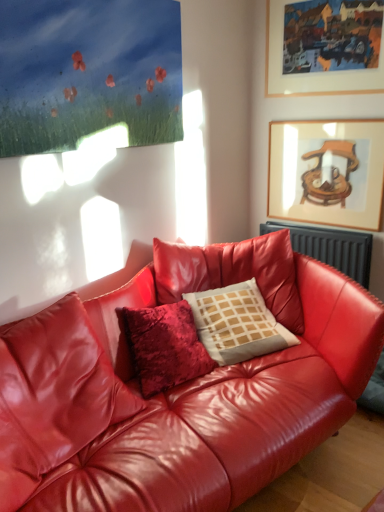
Where is `shiny red leather couch at center`? This screenshot has width=384, height=512. shiny red leather couch at center is located at coordinates (196, 392).

Identify the location of wooden-framed painting at upper right, placed as the second picture frame when sorted from bottom to top. (312, 73).

Do you think white textured pillow at center is within shiny red leather couch at center, or outside of it?

white textured pillow at center lies within the bounds of shiny red leather couch at center.

From the image's perspective, is white textured pillow at center on shiny red leather couch at center?

Yes.

Does white textured pillow at center come in front of shiny red leather couch at center?

No, it is not.

Which object is positioned more to the right, white textured pillow at center or shiny red leather couch at center?

white textured pillow at center is more to the right.

How distant is matte wooden picture frame at upper right, which is counted as the first picture frame, starting from the bottom, from shiny red leather couch at center?

matte wooden picture frame at upper right, which is counted as the first picture frame, starting from the bottom, is 3.50 feet from shiny red leather couch at center.

Which object is thinner, matte wooden picture frame at upper right, which ranks as the second picture frame in top-to-bottom order, or shiny red leather couch at center?

matte wooden picture frame at upper right, which ranks as the second picture frame in top-to-bottom order.

Considering the relative sizes of matte wooden picture frame at upper right, which ranks as the second picture frame in top-to-bottom order, and shiny red leather couch at center in the image provided, is matte wooden picture frame at upper right, which ranks as the second picture frame in top-to-bottom order, shorter than shiny red leather couch at center?

Yes, matte wooden picture frame at upper right, which ranks as the second picture frame in top-to-bottom order, is shorter than shiny red leather couch at center.

How many degrees apart are the facing directions of matte wooden picture frame at upper right, which ranks as the second picture frame in top-to-bottom order, and shiny red leather couch at center?

matte wooden picture frame at upper right, which ranks as the second picture frame in top-to-bottom order, and shiny red leather couch at center are facing 77.8 degrees away from each other.

Considering their positions, is black metallic radiator at upper right located in front of or behind white textured pillow at center?

Visually, black metallic radiator at upper right is located behind white textured pillow at center.

Is point (288, 226) less distant than point (198, 334)?

No.

In order to click on pillow lying in front of the black metallic radiator at upper right in this screenshot , I will do `click(237, 323)`.

Is black metallic radiator at upper right facing away from white textured pillow at center?

That's not correct — black metallic radiator at upper right is not looking away from white textured pillow at center.

Can you confirm if wooden-framed painting at upper right, the 1th picture frame when ordered from top to bottom, is taller than black metallic radiator at upper right?

Correct, wooden-framed painting at upper right, the 1th picture frame when ordered from top to bottom, is much taller as black metallic radiator at upper right.

Does wooden-framed painting at upper right, placed as the second picture frame when sorted from bottom to top, have a lesser width compared to black metallic radiator at upper right?

Indeed, wooden-framed painting at upper right, placed as the second picture frame when sorted from bottom to top, has a lesser width compared to black metallic radiator at upper right.

Does wooden-framed painting at upper right, the 1th picture frame when ordered from top to bottom, turn towards black metallic radiator at upper right?

No, wooden-framed painting at upper right, the 1th picture frame when ordered from top to bottom, is not facing towards black metallic radiator at upper right.

Considering the sizes of objects wooden-framed painting at upper right, placed as the second picture frame when sorted from bottom to top, and shiny red leather couch at center in the image provided, who is taller, wooden-framed painting at upper right, placed as the second picture frame when sorted from bottom to top, or shiny red leather couch at center?

With more height is shiny red leather couch at center.

Between wooden-framed painting at upper right, the 1th picture frame when ordered from top to bottom, and shiny red leather couch at center, which one is positioned in front?

shiny red leather couch at center.

From the image's perspective, does wooden-framed painting at upper right, the 1th picture frame when ordered from top to bottom, appear lower than shiny red leather couch at center?

No.

Which is in front, point (277, 7) or point (39, 350)?

Positioned in front is point (39, 350).

Considering the relative sizes of matte wooden picture frame at upper right, which is counted as the first picture frame, starting from the bottom, and white textured pillow at center in the image provided, is matte wooden picture frame at upper right, which is counted as the first picture frame, starting from the bottom, shorter than white textured pillow at center?

Incorrect, the height of matte wooden picture frame at upper right, which is counted as the first picture frame, starting from the bottom, does not fall short of that of white textured pillow at center.

Is matte wooden picture frame at upper right, which ranks as the second picture frame in top-to-bottom order, beside white textured pillow at center?

No, matte wooden picture frame at upper right, which ranks as the second picture frame in top-to-bottom order, is not next to white textured pillow at center.

Which is in front, point (372, 209) or point (245, 298)?

The point (245, 298) is more forward.

From the image's perspective, who appears lower, matte wooden picture frame at upper right, which is counted as the first picture frame, starting from the bottom, or white textured pillow at center?

white textured pillow at center, from the image's perspective.

Between black metallic radiator at upper right and matte wooden picture frame at upper right, which ranks as the second picture frame in top-to-bottom order, which one appears on the right side from the viewer's perspective?

Positioned to the right is matte wooden picture frame at upper right, which ranks as the second picture frame in top-to-bottom order.

Where is `radiator that is under the matte wooden picture frame at upper right, which is counted as the first picture frame, starting from the bottom (from a real-world perspective)`? Image resolution: width=384 pixels, height=512 pixels. radiator that is under the matte wooden picture frame at upper right, which is counted as the first picture frame, starting from the bottom (from a real-world perspective) is located at coordinates (331, 248).

Choose the correct answer: Is black metallic radiator at upper right inside matte wooden picture frame at upper right, which ranks as the second picture frame in top-to-bottom order, or outside it?

black metallic radiator at upper right is outside matte wooden picture frame at upper right, which ranks as the second picture frame in top-to-bottom order.

From a real-world perspective, which object stands above the other?

From a 3D spatial view, matte wooden picture frame at upper right, which is counted as the first picture frame, starting from the bottom, is above.

In order to click on studio couch lying below the white textured pillow at center (from the image's perspective) in this screenshot , I will do `click(196, 392)`.

The height and width of the screenshot is (512, 384). Identify the location of studio couch below the matte wooden picture frame at upper right, which ranks as the second picture frame in top-to-bottom order (from a real-world perspective). (196, 392).

Considering their positions, is shiny red leather couch at center positioned closer to wooden-framed painting at upper right, the 1th picture frame when ordered from top to bottom, than white textured pillow at center?

white textured pillow at center is positioned closer to the anchor wooden-framed painting at upper right, the 1th picture frame when ordered from top to bottom.

Considering their positions, is wooden-framed painting at upper right, the 1th picture frame when ordered from top to bottom, positioned closer to shiny red leather couch at center than matte wooden picture frame at upper right, which ranks as the second picture frame in top-to-bottom order?

Among the two, matte wooden picture frame at upper right, which ranks as the second picture frame in top-to-bottom order, is located nearer to shiny red leather couch at center.

Which object lies nearer to the anchor point black metallic radiator at upper right, shiny red leather couch at center or white textured pillow at center?

The object closer to black metallic radiator at upper right is white textured pillow at center.

From the image, which object appears to be farther from wooden-framed painting at upper right, placed as the second picture frame when sorted from bottom to top, black metallic radiator at upper right or shiny red leather couch at center?

Among the two, shiny red leather couch at center is located further to wooden-framed painting at upper right, placed as the second picture frame when sorted from bottom to top.

Estimate the real-world distances between objects in this image. Which object is closer to black metallic radiator at upper right, white textured pillow at center or shiny red leather couch at center?

white textured pillow at center lies closer to black metallic radiator at upper right than the other object.

Which object lies further to the anchor point black metallic radiator at upper right, matte wooden picture frame at upper right, which is counted as the first picture frame, starting from the bottom, or shiny red leather couch at center?

The object further to black metallic radiator at upper right is shiny red leather couch at center.

When comparing their distances from wooden-framed painting at upper right, the 1th picture frame when ordered from top to bottom, does shiny red leather couch at center or black metallic radiator at upper right seem closer?

black metallic radiator at upper right lies closer to wooden-framed painting at upper right, the 1th picture frame when ordered from top to bottom, than the other object.

In the scene shown: When comparing their distances from black metallic radiator at upper right, does wooden-framed painting at upper right, placed as the second picture frame when sorted from bottom to top, or shiny red leather couch at center seem closer?

shiny red leather couch at center lies closer to black metallic radiator at upper right than the other object.

The width and height of the screenshot is (384, 512). Identify the location of pillow that lies between wooden-framed painting at upper right, the 1th picture frame when ordered from top to bottom, and shiny red leather couch at center from top to bottom. (237, 323).

At what (x,y) coordinates should I click in order to perform the action: click on radiator between matte wooden picture frame at upper right, which ranks as the second picture frame in top-to-bottom order, and white textured pillow at center, in the vertical direction. Please return your answer as a coordinate pair (x, y). This screenshot has height=512, width=384. Looking at the image, I should click on (331, 248).

The height and width of the screenshot is (512, 384). What are the coordinates of `picture frame between wooden-framed painting at upper right, the 1th picture frame when ordered from top to bottom, and shiny red leather couch at center vertically` in the screenshot? It's located at (327, 172).

At what (x,y) coordinates should I click in order to perform the action: click on radiator between wooden-framed painting at upper right, placed as the second picture frame when sorted from bottom to top, and shiny red leather couch at center from top to bottom. Please return your answer as a coordinate pair (x, y). The image size is (384, 512). Looking at the image, I should click on (331, 248).